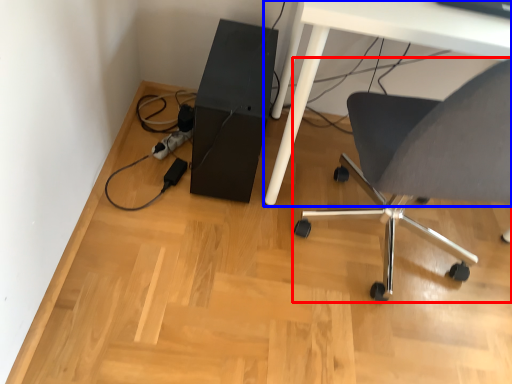
Question: Among these objects, which one is nearest to the camera, chair (highlighted by a red box) or table (highlighted by a blue box)?

Choices:
 (A) chair
 (B) table

Answer: (A)